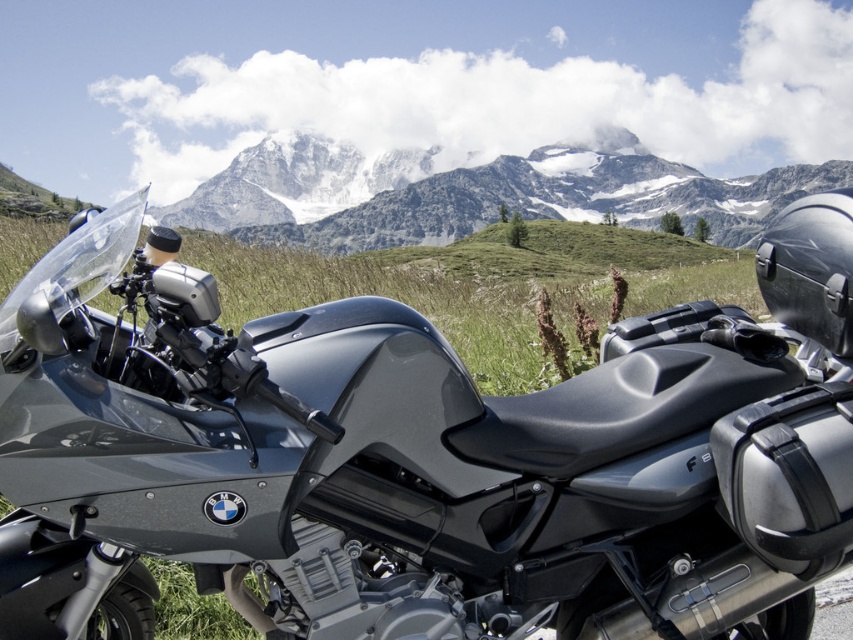
You are a photographer planning to capture the matte black motorcycle at lower left and the snowy granite mountain at upper center in the same frame. Based on their positions, which object would appear closer to the bottom of the photo?

The matte black motorcycle at lower left is located below the snowy granite mountain at upper center, so it would appear closer to the bottom of the photo.

You are standing at a point 47.17 feet away from the point marked at coordinates point (666, 317). The scene shows a BMW motorcycle parked in a mountainous area with snowcapped mountains in the background. Can you estimate how far you are from the motorcycle?

The point marked at coordinates point (666, 317) is 47.17 feet away from the viewer, so you are approximately 47.17 feet away from the motorcycle.

You are a photographer planning to take a photo of the matte black motorcycle at lower left. You need to position your camera so that it aligns with the point marked at coordinates (421, 458). Is this point located on the motorcycle?

Yes, the point at coordinates (421, 458) marks the matte black motorcycle at lower left, so it is located on the motorcycle.